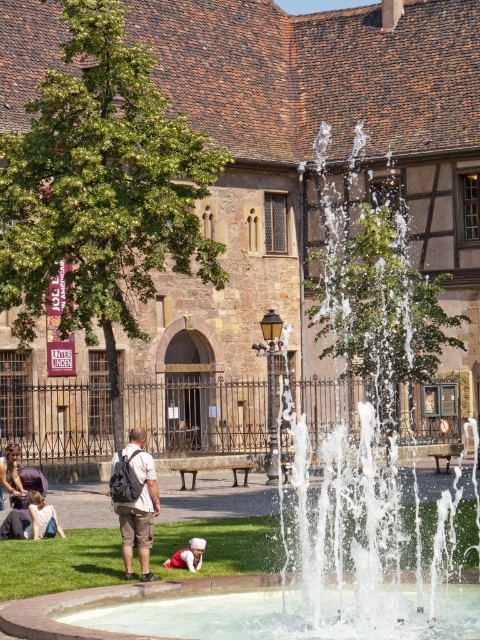
You are a delivery robot with a package that needs to be placed between the matte black backpack at center and the red fabric pants at lower center. The package requires a minimum of 1.5 meters of space to be safely placed. Is there enough space between them?

The distance between the matte black backpack at center and the red fabric pants at lower center is 1.26 meters, which is less than the required 1.5 meters. Therefore, there is not enough space to safely place the package between them.

From the picture: You are standing in the town square and want to place a small potted plant exactly at the center of the square. The square is a perfect square with coordinates from 0 to 1 on both axes. Given the location of the matte black backpack at lower left, where should you place the potted plant?

The center of the square would be at point [240,320]. Since the matte black backpack at lower left is at point [10,472], you should place the potted plant at the center coordinates [240,320].